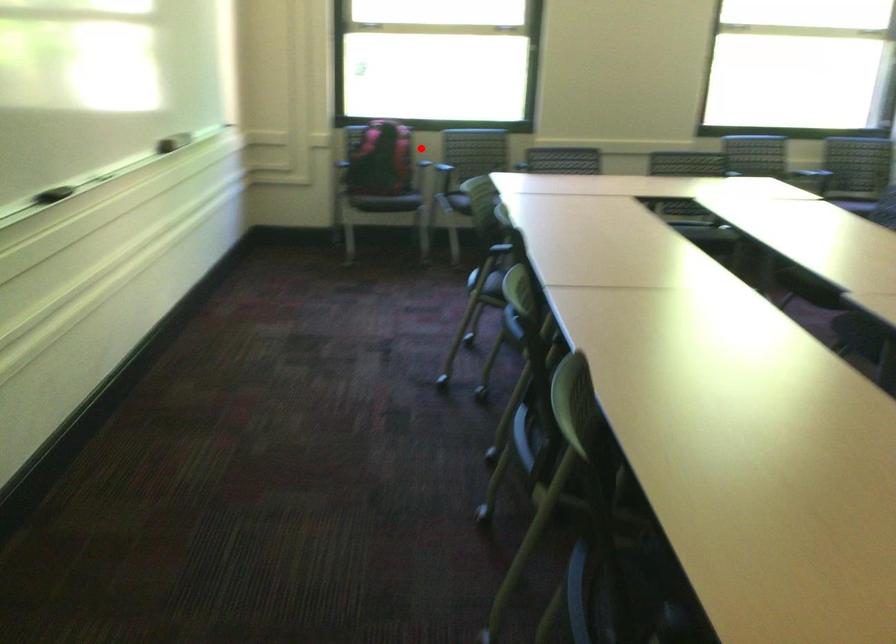
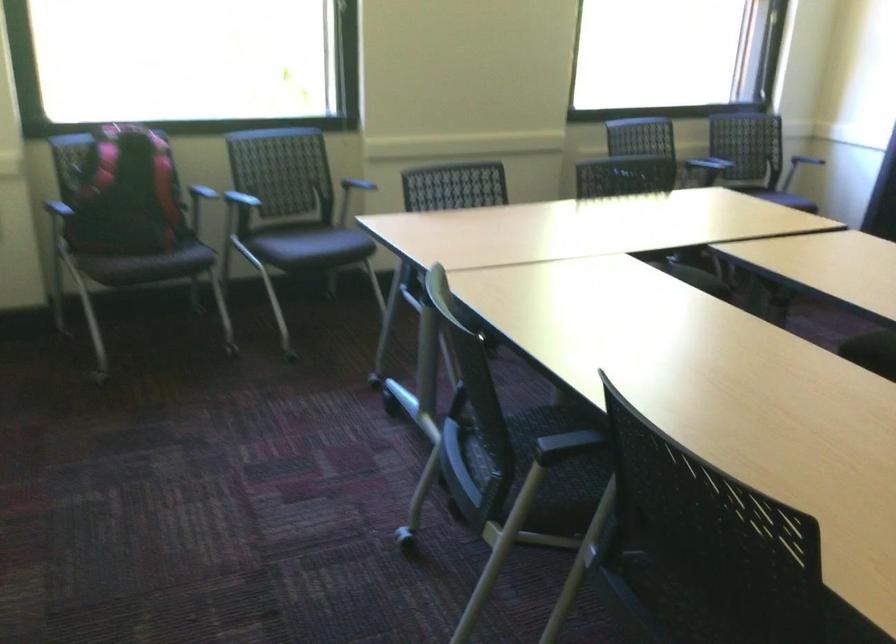
Question: I am providing you with two images of the same scene from different viewpoints. Image1 has a red point marked. In image2, the corresponding 3D location appears at what relative position? Reply with the corresponding letter.

Choices:
 (A) Closer
 (B) Farther

Answer: (A)